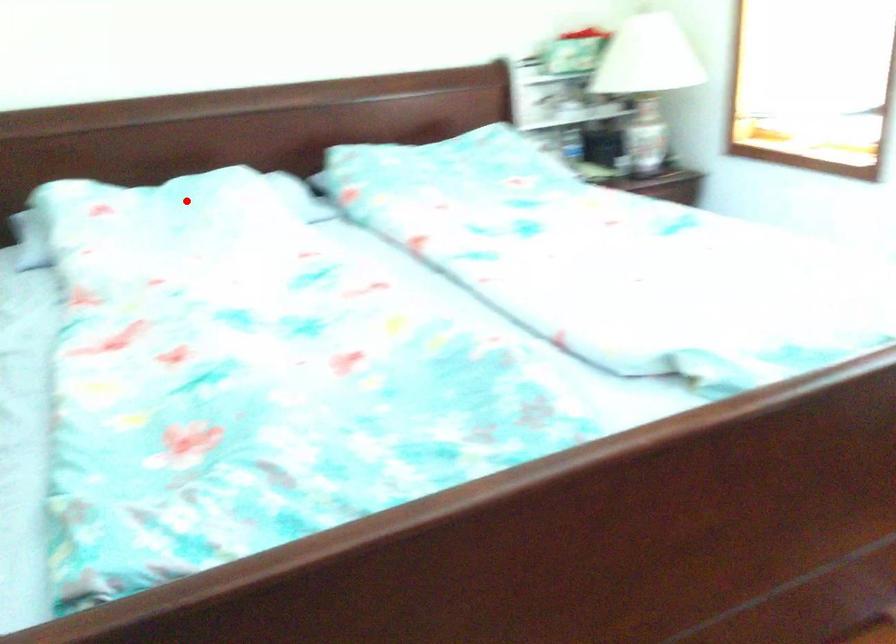
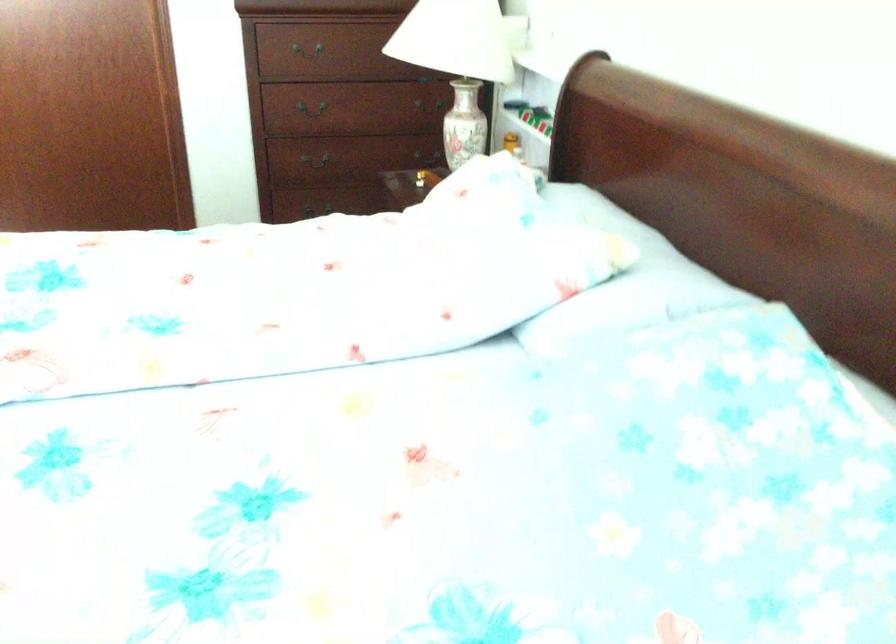
Where in the second image is the point corresponding to the highlighted location from the first image?

(618, 275)